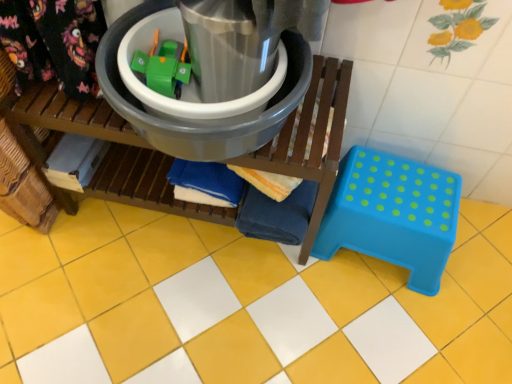
Question: Does metallic plastic bucket at center have a greater width compared to blue plastic step stool at lower right?

Choices:
 (A) no
 (B) yes

Answer: (A)

Question: Is metallic plastic bucket at center beside blue plastic step stool at lower right?

Choices:
 (A) no
 (B) yes

Answer: (A)

Question: From a real-world perspective, is metallic plastic bucket at center located higher than blue plastic step stool at lower right?

Choices:
 (A) yes
 (B) no

Answer: (A)

Question: Is metallic plastic bucket at center smaller than blue plastic step stool at lower right?

Choices:
 (A) no
 (B) yes

Answer: (B)

Question: Can blue plastic step stool at lower right be found inside metallic plastic bucket at center?

Choices:
 (A) no
 (B) yes

Answer: (A)

Question: Considering their positions, is yellow glossy tile at center located in front of or behind metallic plastic bucket at center?

Choices:
 (A) behind
 (B) front

Answer: (A)

Question: Considering the positions of yellow glossy tile at center and metallic plastic bucket at center in the image, is yellow glossy tile at center wider or thinner than metallic plastic bucket at center?

Choices:
 (A) wide
 (B) thin

Answer: (A)

Question: From the image's perspective, is yellow glossy tile at center located above or below metallic plastic bucket at center?

Choices:
 (A) above
 (B) below

Answer: (B)

Question: Is yellow glossy tile at center spatially inside metallic plastic bucket at center, or outside of it?

Choices:
 (A) inside
 (B) outside

Answer: (B)

Question: Do you think metallic plastic bucket at center is within matte plastic bucket at center, or outside of it?

Choices:
 (A) inside
 (B) outside

Answer: (B)

Question: Is point (227, 125) closer or farther from the camera than point (320, 142)?

Choices:
 (A) farther
 (B) closer

Answer: (B)

Question: From a real-world perspective, is metallic plastic bucket at center above or below matte plastic bucket at center?

Choices:
 (A) above
 (B) below

Answer: (A)

Question: From the image's perspective, is metallic plastic bucket at center above or below matte plastic bucket at center?

Choices:
 (A) above
 (B) below

Answer: (A)

Question: Looking at their shapes, would you say matte plastic bucket at center is wider or thinner than blue plastic step stool at lower right?

Choices:
 (A) wide
 (B) thin

Answer: (A)

Question: Considering their positions, is matte plastic bucket at center located in front of or behind blue plastic step stool at lower right?

Choices:
 (A) behind
 (B) front

Answer: (B)